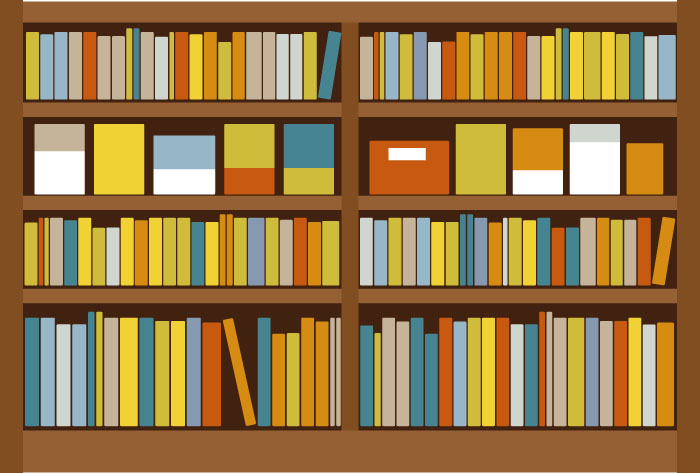
In order to click on book shelved with cover facing viewer in this screenshot , I will do pyautogui.click(x=57, y=166), pyautogui.click(x=122, y=154), pyautogui.click(x=186, y=167), pyautogui.click(x=245, y=161), pyautogui.click(x=308, y=168), pyautogui.click(x=391, y=174), pyautogui.click(x=483, y=168), pyautogui.click(x=547, y=166), pyautogui.click(x=606, y=165), pyautogui.click(x=643, y=172).